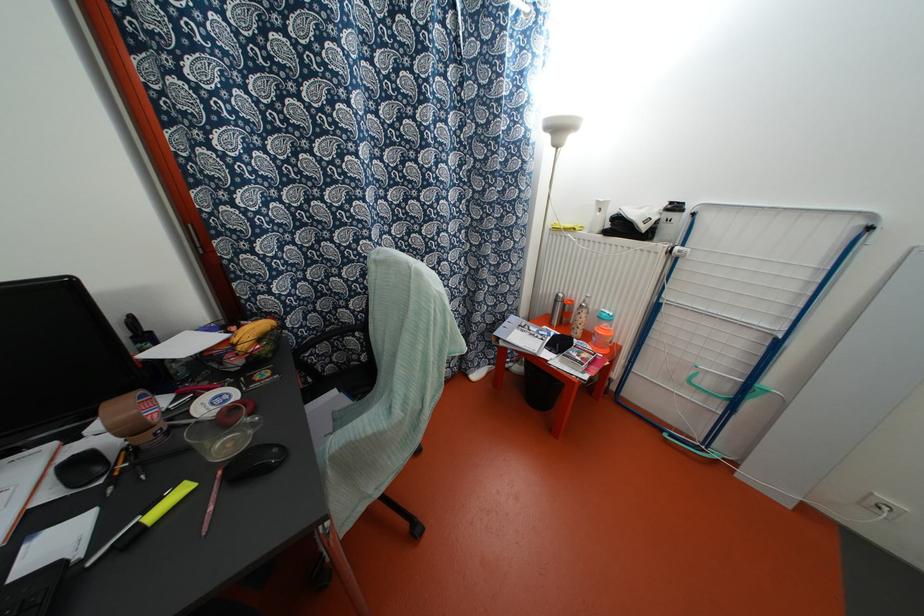
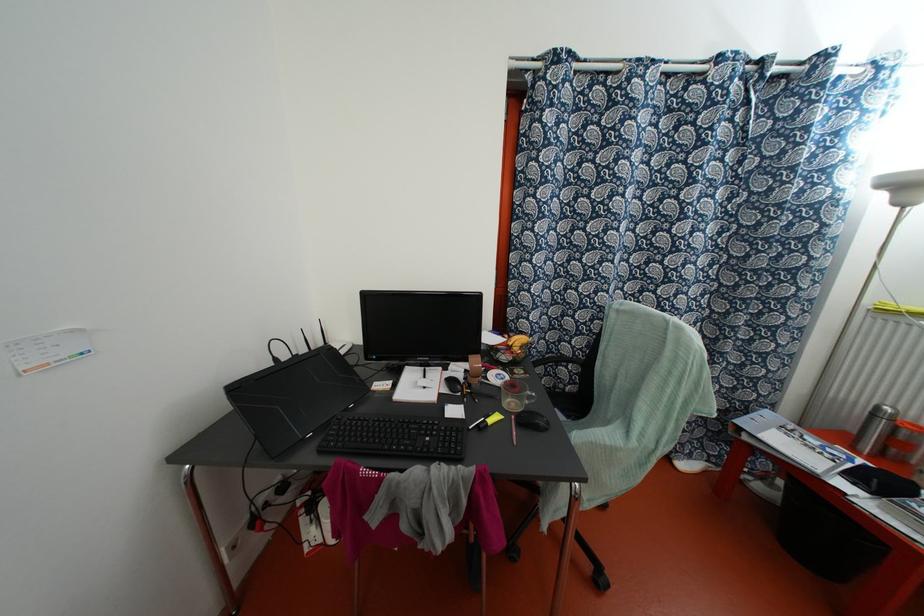
Where in the second image is the point corresponding to (234,362) from the first image?

(504, 357)